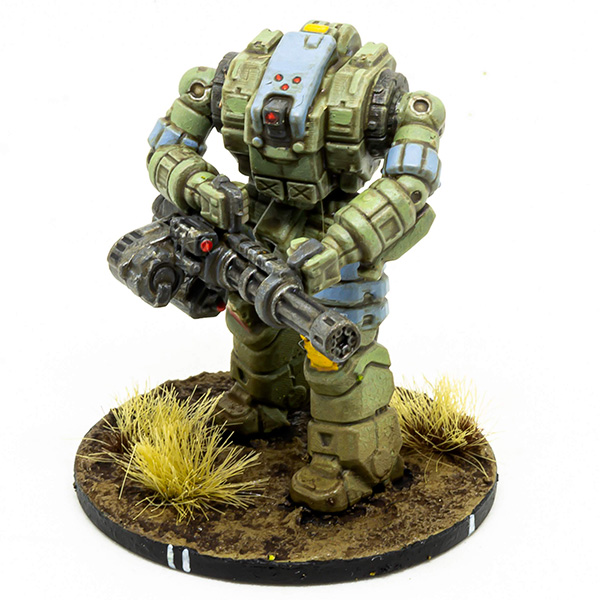
The width and height of the screenshot is (600, 600). In order to click on figurine in this screenshot , I will do `click(305, 189)`.